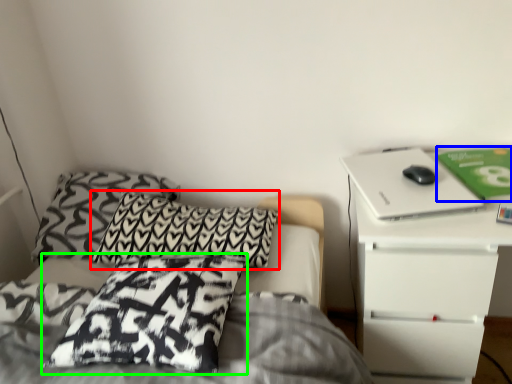
Question: Considering the real-world distances, which object is closest to pillow (highlighted by a red box)? paperback book (highlighted by a blue box) or pillow (highlighted by a green box).

Choices:
 (A) paperback book
 (B) pillow

Answer: (B)